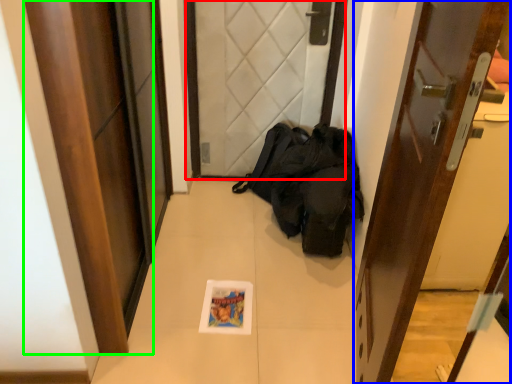
Question: Which is farther away from door (highlighted by a red box)? door (highlighted by a blue box) or door (highlighted by a green box)?

Choices:
 (A) door
 (B) door

Answer: (A)